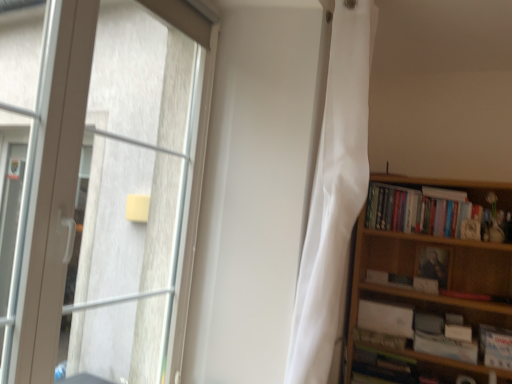
Question: Is hardcover book at lower right, the fifth book from the top, oriented away from white paper book at right, marked as the second book in a bottom-to-top arrangement?

Choices:
 (A) yes
 (B) no

Answer: (B)

Question: Is white paper book at right, marked as the second book in a bottom-to-top arrangement, a part of hardcover book at lower right, acting as the first book starting from the bottom?

Choices:
 (A) no
 (B) yes

Answer: (A)

Question: Does hardcover book at lower right, acting as the first book starting from the bottom, come behind white paper book at right, the 4th book viewed from the top?

Choices:
 (A) no
 (B) yes

Answer: (B)

Question: Can you confirm if hardcover book at lower right, acting as the first book starting from the bottom, is shorter than white paper book at right, the 4th book viewed from the top?

Choices:
 (A) no
 (B) yes

Answer: (B)

Question: From a real-world perspective, is hardcover book at lower right, acting as the first book starting from the bottom, positioned over white paper book at right, marked as the second book in a bottom-to-top arrangement, based on gravity?

Choices:
 (A) yes
 (B) no

Answer: (B)

Question: In the image, is hardcover book at lower right, the fifth book from the top, positioned in front of or behind white matte book at lower right, arranged as the third book when viewed from the top?

Choices:
 (A) front
 (B) behind

Answer: (A)

Question: Based on their sizes in the image, would you say hardcover book at lower right, the fifth book from the top, is bigger or smaller than white matte book at lower right, which ranks as the third book in bottom-to-top order?

Choices:
 (A) big
 (B) small

Answer: (A)

Question: From the image's perspective, is hardcover book at lower right, acting as the first book starting from the bottom, located above or below white matte book at lower right, which ranks as the third book in bottom-to-top order?

Choices:
 (A) above
 (B) below

Answer: (B)

Question: Is hardcover book at lower right, the fifth book from the top, taller or shorter than white matte book at lower right, which ranks as the third book in bottom-to-top order?

Choices:
 (A) tall
 (B) short

Answer: (B)

Question: Is hardcover book at lower right, the fifth book from the top, spatially inside wooden bookcase at right, or outside of it?

Choices:
 (A) inside
 (B) outside

Answer: (A)

Question: In terms of width, does hardcover book at lower right, acting as the first book starting from the bottom, look wider or thinner when compared to wooden bookcase at right?

Choices:
 (A) thin
 (B) wide

Answer: (A)

Question: Does point (385, 367) appear closer or farther from the camera than point (498, 258)?

Choices:
 (A) farther
 (B) closer

Answer: (A)

Question: Looking at the image, does hardcover book at lower right, acting as the first book starting from the bottom, seem bigger or smaller compared to wooden bookcase at right?

Choices:
 (A) small
 (B) big

Answer: (A)

Question: From a real-world perspective, is matte black portrait at upper right, the second paperback book positioned from the bottom, positioned above or below white matte book at right, acting as the 2th book starting from the top?

Choices:
 (A) below
 (B) above

Answer: (B)

Question: Based on their sizes in the image, would you say matte black portrait at upper right, which is the 1th paperback book from top to bottom, is bigger or smaller than white matte book at right, which appears as the fourth book when ordered from the bottom?

Choices:
 (A) big
 (B) small

Answer: (B)